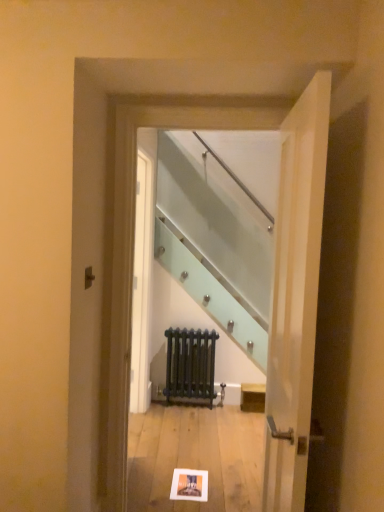
Question: Is clear glass staircase at center smaller than white wood door at right?

Choices:
 (A) yes
 (B) no

Answer: (A)

Question: From the image's perspective, is clear glass staircase at center located beneath white wood door at right?

Choices:
 (A) no
 (B) yes

Answer: (A)

Question: From the image's perspective, does clear glass staircase at center appear higher than white wood door at right?

Choices:
 (A) yes
 (B) no

Answer: (A)

Question: Is clear glass staircase at center oriented away from white wood door at right?

Choices:
 (A) yes
 (B) no

Answer: (B)

Question: Is clear glass staircase at center outside white wood door at right?

Choices:
 (A) yes
 (B) no

Answer: (A)

Question: Is point (180, 473) closer or farther from the camera than point (201, 386)?

Choices:
 (A) closer
 (B) farther

Answer: (A)

Question: From the image's perspective, is white paper postcard at center located above or below matte black radiator at center?

Choices:
 (A) above
 (B) below

Answer: (B)

Question: Is white paper postcard at center to the left or to the right of matte black radiator at center in the image?

Choices:
 (A) left
 (B) right

Answer: (A)

Question: Would you say white paper postcard at center is inside or outside matte black radiator at center?

Choices:
 (A) outside
 (B) inside

Answer: (A)

Question: Considering the positions of point (170, 390) and point (304, 330), is point (170, 390) closer or farther from the camera than point (304, 330)?

Choices:
 (A) closer
 (B) farther

Answer: (B)

Question: Would you say matte black radiator at center is inside or outside white wood door at right?

Choices:
 (A) outside
 (B) inside

Answer: (A)

Question: In terms of height, does matte black radiator at center look taller or shorter compared to white wood door at right?

Choices:
 (A) short
 (B) tall

Answer: (A)

Question: From a real-world perspective, is matte black radiator at center positioned above or below white wood door at right?

Choices:
 (A) above
 (B) below

Answer: (B)

Question: Considering their positions, is white paper postcard at center located in front of or behind white wood door at right?

Choices:
 (A) front
 (B) behind

Answer: (B)

Question: From the image's perspective, relative to white wood door at right, is white paper postcard at center above or below?

Choices:
 (A) above
 (B) below

Answer: (B)